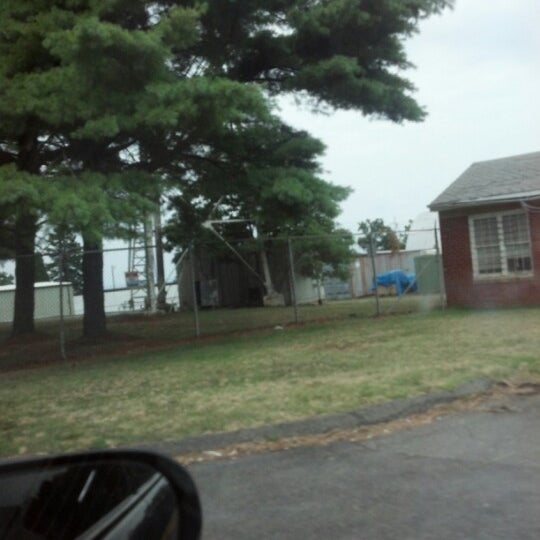
Identify the location of window trim. The image size is (540, 540). (502, 245), (474, 272).